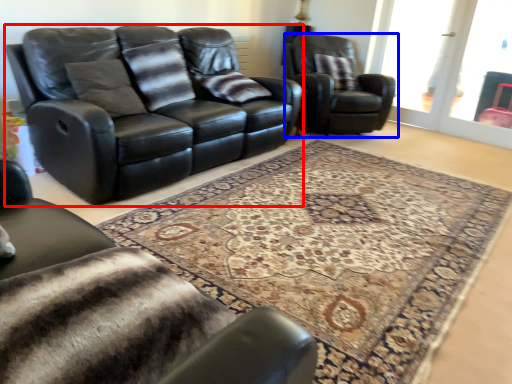
Question: Which of the following is the farthest to the observer, studio couch (highlighted by a red box) or chair (highlighted by a blue box)?

Choices:
 (A) studio couch
 (B) chair

Answer: (B)